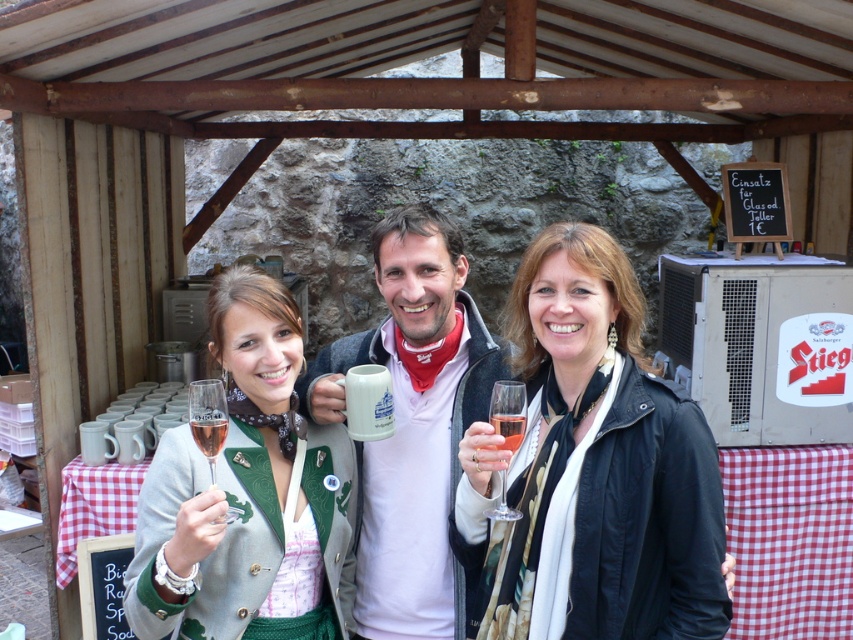
Does clear glass wine glass at lower left have a lesser width compared to clear glass champagne flute at lower left?

No, clear glass wine glass at lower left is not thinner than clear glass champagne flute at lower left.

Which is above, clear glass wine glass at lower left or clear glass champagne flute at lower left?

clear glass champagne flute at lower left is higher up.

Identify the location of clear glass wine glass at lower left. The height and width of the screenshot is (640, 853). (207, 419).

You are a GUI agent. You are given a task and a screenshot of the screen. Output one action in this format:
    pyautogui.click(x=<x>, y=<y>)
    Task: Click on the clear glass wine glass at lower left
    
    Given the screenshot: What is the action you would take?
    pyautogui.click(x=207, y=419)

Between point (202, 438) and point (512, 449), which one is positioned behind?

Point (512, 449)

Does clear glass champagne flute at lower left appear under translucent glass wine at center?

Yes, clear glass champagne flute at lower left is below translucent glass wine at center.

Who is more forward, (x=193, y=419) or (x=503, y=420)?

Point (x=193, y=419) is in front.

Locate an element on the screen. clear glass champagne flute at lower left is located at coordinates (209, 433).

Between point (212, 632) and point (195, 419), which one is positioned in front?

Positioned in front is point (195, 419).

Does point (328, 486) lie in front of point (199, 429)?

No, (328, 486) is further to viewer.

Who is more distant from viewer, (x=230, y=452) or (x=212, y=440)?

The point (x=230, y=452) is behind.

This screenshot has width=853, height=640. I want to click on green wool jacket at center, so click(x=248, y=493).